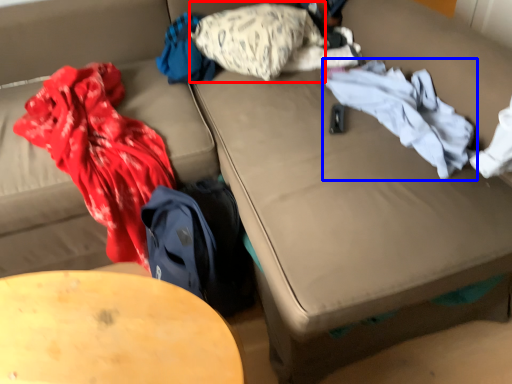
Question: Which object is closer to the camera taking this photo, pillow (highlighted by a red box) or clothing (highlighted by a blue box)?

Choices:
 (A) pillow
 (B) clothing

Answer: (B)